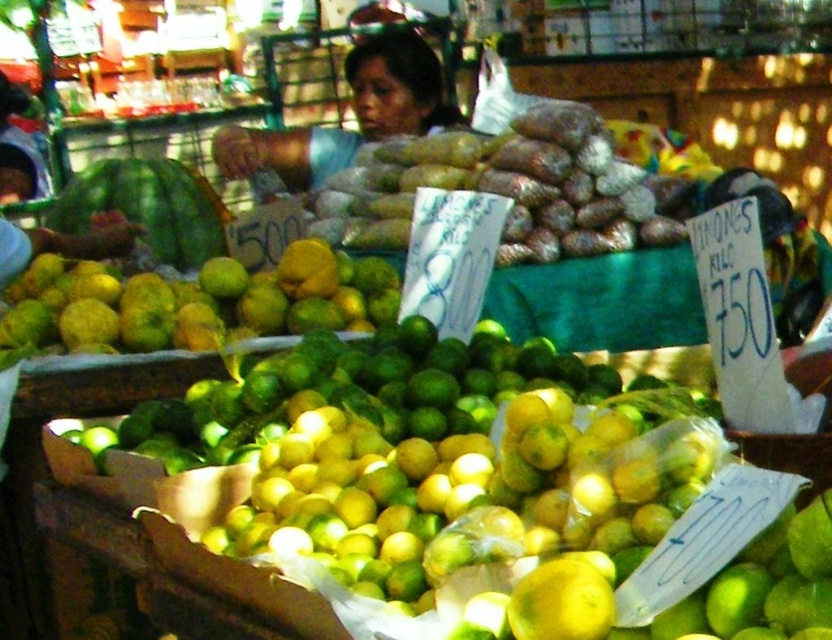
Question: Is yellow matte citrus at center wider than yellow matte lemon at center?

Choices:
 (A) no
 (B) yes

Answer: (B)

Question: Is blue fabric shirt at center to the left of yellow matte lemon at center from the viewer's perspective?

Choices:
 (A) no
 (B) yes

Answer: (B)

Question: Which object is positioned closest to the blue fabric shirt at center?

Choices:
 (A) yellow matte lemon at center
 (B) yellow matte citrus at center

Answer: (B)

Question: Can you confirm if yellow matte citrus at center is bigger than blue fabric shirt at center?

Choices:
 (A) yes
 (B) no

Answer: (B)

Question: Which point appears farthest from the camera in this image?

Choices:
 (A) (535, 596)
 (B) (92, 269)

Answer: (B)

Question: Considering the real-world distances, which object is farthest from the yellow matte lemon at center?

Choices:
 (A) yellow matte citrus at center
 (B) blue fabric shirt at center

Answer: (B)